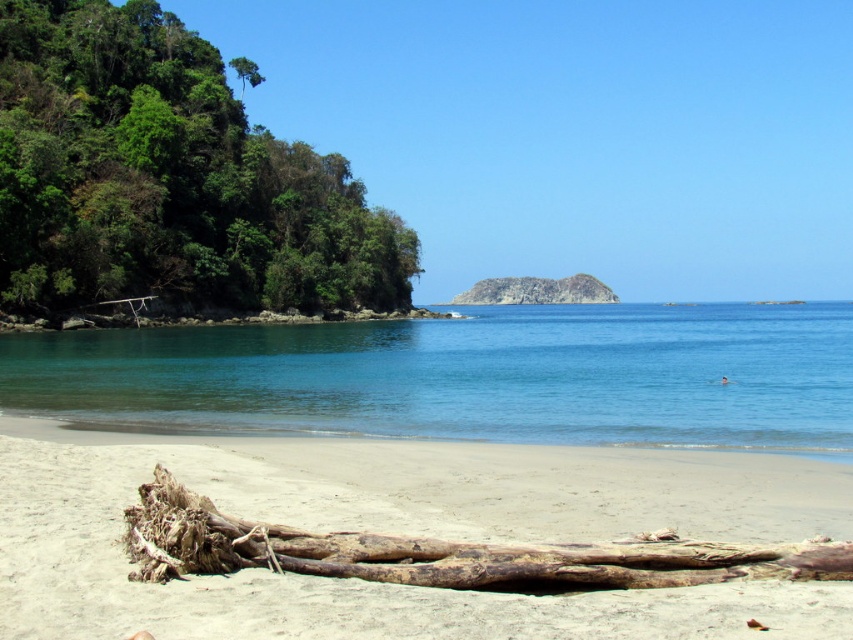
Question: Can you confirm if light beige sand at lower center is positioned to the left of clear blue water at center?

Choices:
 (A) yes
 (B) no

Answer: (A)

Question: Which is farther from the rusty rock at center?

Choices:
 (A) light beige sand at lower center
 (B) clear blue water at center

Answer: (A)

Question: Estimate the real-world distances between objects in this image. Which object is closer to the light beige sand at lower center?

Choices:
 (A) rusty rock at center
 (B) clear blue water at center

Answer: (B)

Question: Can you confirm if light beige sand at lower center is bigger than clear blue water at center?

Choices:
 (A) no
 (B) yes

Answer: (A)

Question: Does light beige sand at lower center appear on the right side of rusty rock at center?

Choices:
 (A) no
 (B) yes

Answer: (A)

Question: Which of the following is the farthest from the observer?

Choices:
 (A) (537, 291)
 (B) (585, 630)
 (C) (321, 428)

Answer: (A)